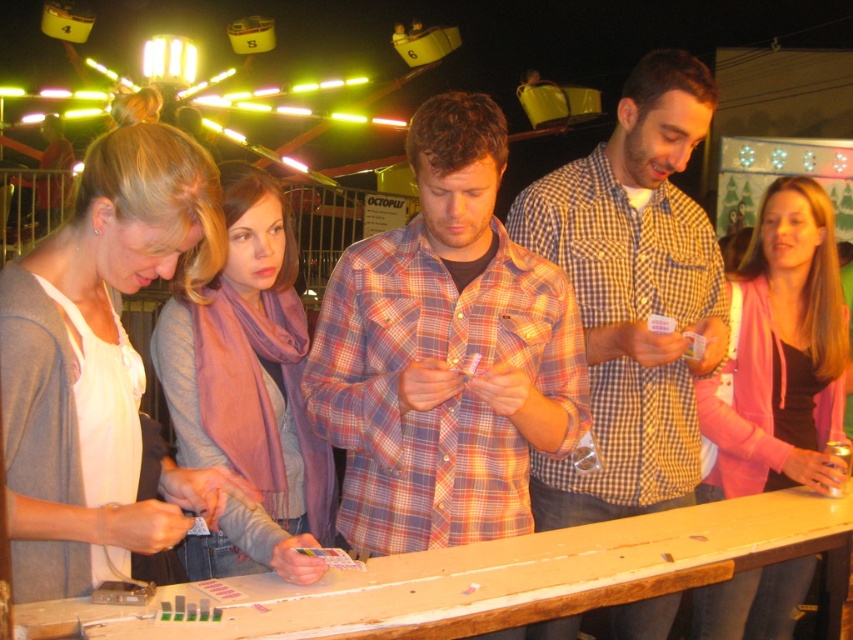
Question: Which of the following is the farthest from the observer?

Choices:
 (A) (85, 474)
 (B) (512, 429)

Answer: (B)

Question: Can you confirm if purple scarf at center is positioned below pink fabric jacket at center?

Choices:
 (A) no
 (B) yes

Answer: (B)

Question: Is checkered shirt at center positioned at the back of purple scarf at center?

Choices:
 (A) yes
 (B) no

Answer: (A)

Question: Considering the relative positions of purple scarf at center and pink fabric jacket at center in the image provided, where is purple scarf at center located with respect to pink fabric jacket at center?

Choices:
 (A) below
 (B) above

Answer: (A)

Question: Which of the following is the farthest from the observer?

Choices:
 (A) checkered shirt at center
 (B) plaid shirt at center

Answer: (A)

Question: Which object is positioned farthest from the matte gray cardigan at left?

Choices:
 (A) purple scarf at center
 (B) plaid shirt at center
 (C) checkered shirt at center
 (D) pink fabric jacket at center

Answer: (D)